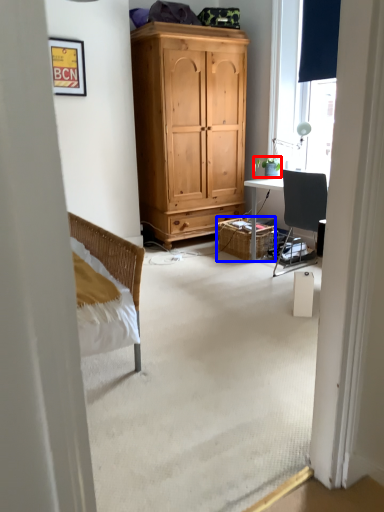
Question: Which of the following is the closest to the observer, houseplant (highlighted by a red box) or picnic basket (highlighted by a blue box)?

Choices:
 (A) houseplant
 (B) picnic basket

Answer: (A)